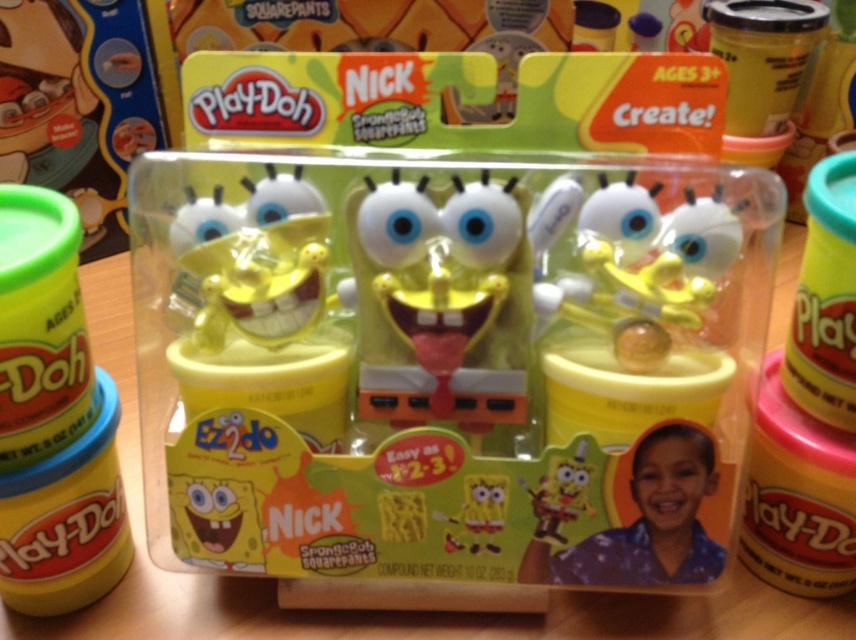
Question: Which point appears closest to the camera in this image?

Choices:
 (A) (450, 531)
 (B) (703, 580)

Answer: (B)

Question: Which object is closer to the camera taking this photo?

Choices:
 (A) yellow matte sponge at center
 (B) matte yellow sponge at center

Answer: (B)

Question: Which object is closer to the camera taking this photo?

Choices:
 (A) matte yellow sponge at center
 (B) yellow matte sponge at center

Answer: (A)

Question: In this image, where is matte yellow sponge at center located relative to yellow matte sponge at center?

Choices:
 (A) right
 (B) left

Answer: (A)

Question: Is matte yellow sponge at center closer to the viewer compared to yellow matte sponge at center?

Choices:
 (A) yes
 (B) no

Answer: (A)

Question: Does matte yellow sponge at center come in front of yellow matte sponge at center?

Choices:
 (A) no
 (B) yes

Answer: (B)